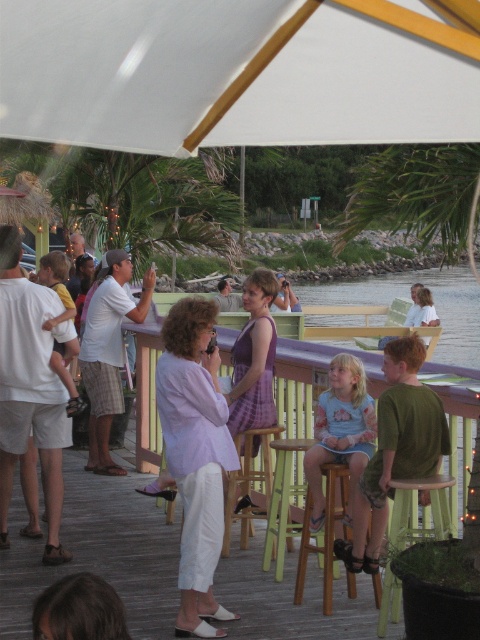
Question: Which of the following is the farthest from the observer?

Choices:
 (A) green cotton shirt at center
 (B) green wood bar stool at center
 (C) white cotton shirt at left

Answer: (C)

Question: Which point appears farthest from the camera in this image?

Choices:
 (A) (111, 625)
 (B) (275, 486)
 (C) (57, 490)

Answer: (C)

Question: Which point is closer to the camera?

Choices:
 (A) light blue denim shorts at center
 (B) green wood bar stool at center
 (C) white plaid shorts at left

Answer: (A)

Question: Can you confirm if brown hair at lower left is positioned above wooden bar stool at center?

Choices:
 (A) yes
 (B) no

Answer: (A)

Question: In this image, where is white cotton shirt at left located relative to green cotton shirt at center?

Choices:
 (A) below
 (B) above

Answer: (B)

Question: Is wooden bar stool at center smaller than purple fabric dress at center?

Choices:
 (A) yes
 (B) no

Answer: (A)